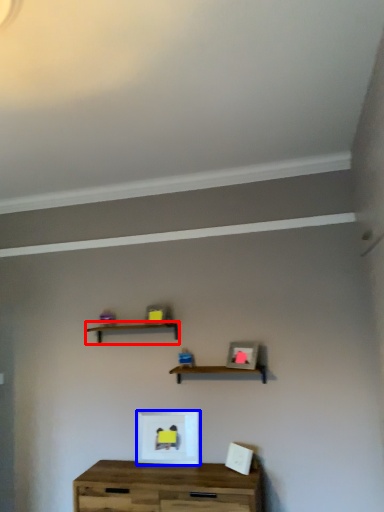
Question: Which point is closer to the camera, shelf (highlighted by a red box) or picture frame (highlighted by a blue box)?

Choices:
 (A) shelf
 (B) picture frame

Answer: (B)